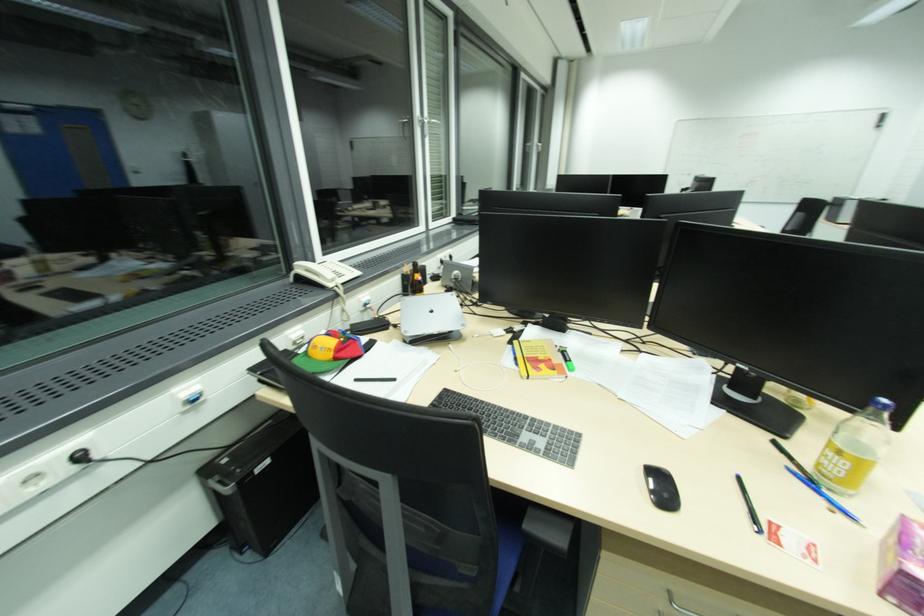
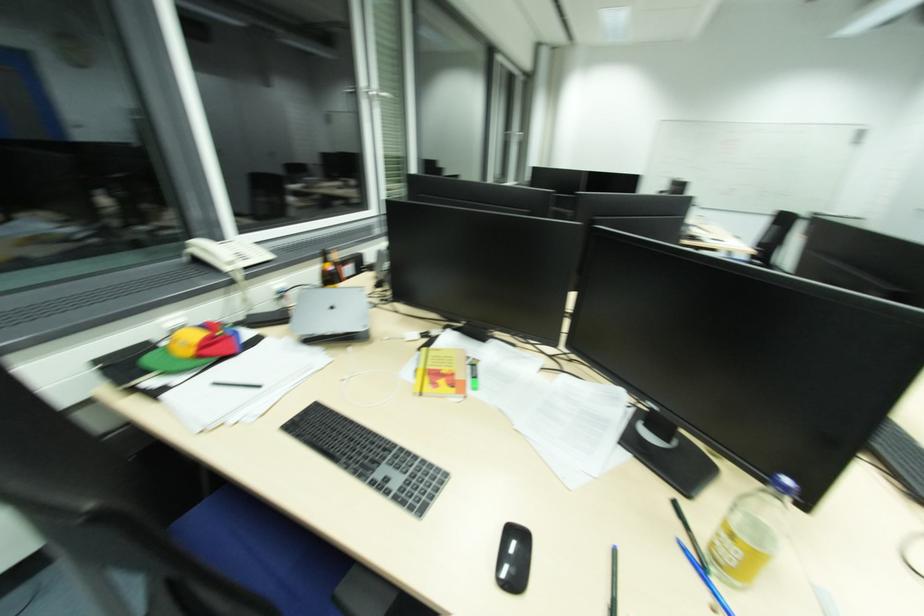
Locate, in the second image, the point that corresponds to (338,360) in the first image.

(201, 359)